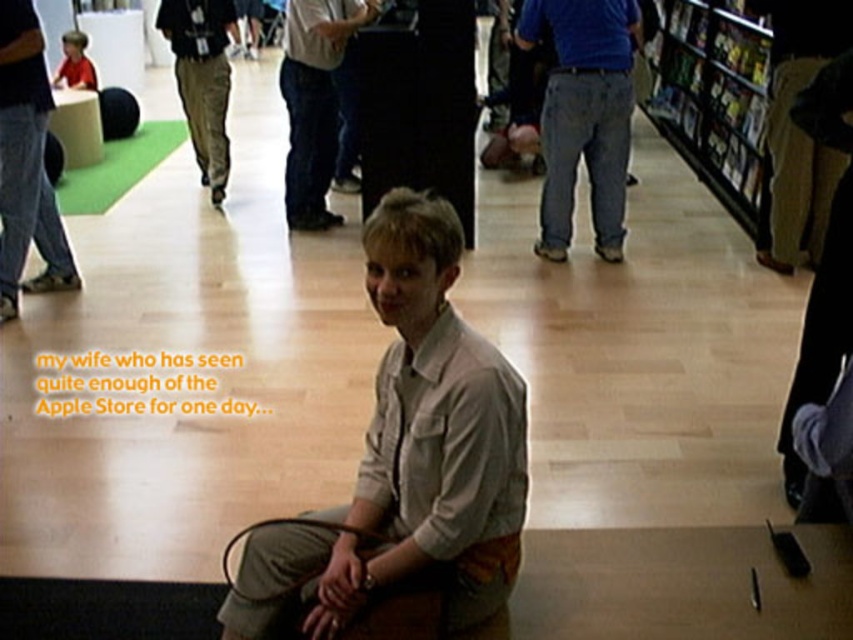
You are an employee in the store and need to determine if the light gray shirt at center can be hung on a hanger that is designed to hold items up to the height of the khaki pants at center. Can it be hung without issues?

The light gray shirt at center is not as tall as khaki pants at center, so it can be safely hung on the hanger designed for the height of the khaki pants at center without any issues.

You are a customer in the store and want to ask the person at center for directions. Which object should you approach first, the denim jeans at center or the light gray shirt at center, to get closer to the person?

You should approach the light gray shirt at center first because it is to the left of denim jeans at center, meaning the light gray shirt at center is closer to your starting position if you are approaching from the left side of the frame. However, since both are at the center, their positions relative to each other indicate that the light gray shirt at center is on the left side of the denim jeans at center. To reach the person at the center, you would need to move towards either, but based on their left?